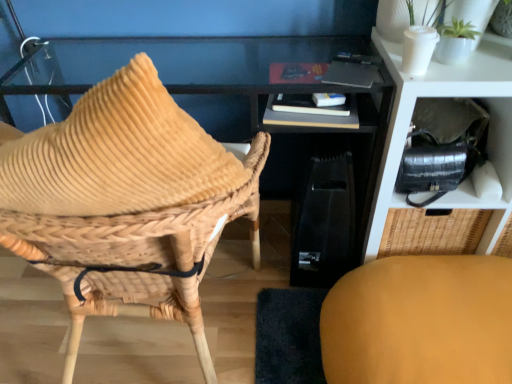
You are a GUI agent. You are given a task and a screenshot of the screen. Output one action in this format:
    pyautogui.click(x=<x>, y=<y>)
    Task: Click on the free point below woven wood chair at left, arranged as the first chair when viewed from the left (from a real-world perspective)
    The image size is (512, 384).
    Given the screenshot: What is the action you would take?
    pyautogui.click(x=175, y=335)